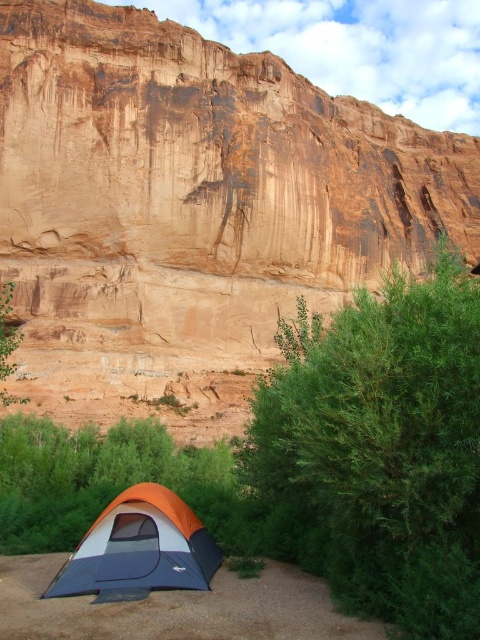
You are a hiker who has just set up camp. You notice a green leafy bush at lower right and an orange fabric tent at lower left. Which object is positioned higher relative to the other?

The green leafy bush at lower right is positioned above the orange fabric tent at lower left.

You are a hiker who wants to take a photo of the matte sandstone cliff at upper center and the orange fabric tent at lower left. Which object should you focus on first if you want to capture both in a single shot without adjusting your camera focus?

You should focus on the matte sandstone cliff at upper center first because it is closer to you than the orange fabric tent at lower left, allowing both objects to be in focus if the depth of field is sufficient.

You are setting up a campsite and want to ensure your tent is positioned safely away from the cliff. Based on the scene, which direction should you move the orange fabric tent at lower left to be further away from the matte sandstone cliff at upper center?

To move the orange fabric tent at lower left further away from the matte sandstone cliff at upper center, you should move it to the left. Since the cliff is to the right of the tent, moving left would increase the distance between them.